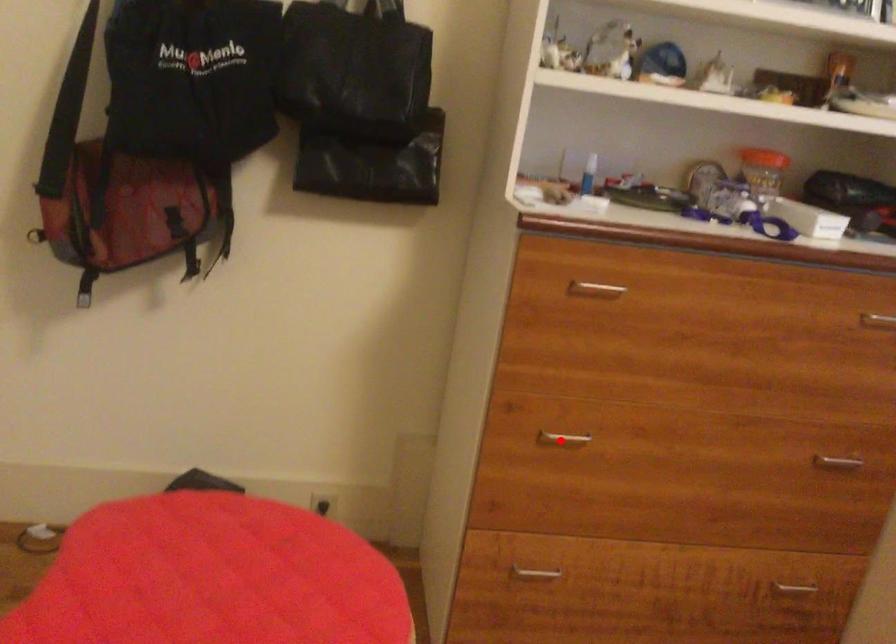
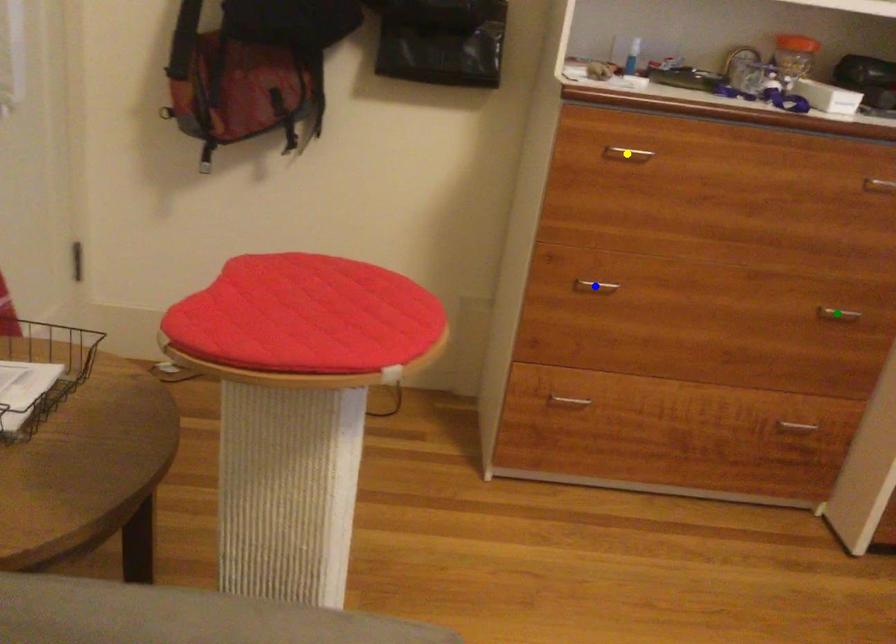
Question: I am providing you with two images of the same scene from different viewpoints. A red point is marked on the first image. You are given multiple points on the second image. Can you choose the point in image 2 that corresponds to the point in image 1?

Choices:
 (A) blue point
 (B) green point
 (C) yellow point

Answer: (A)